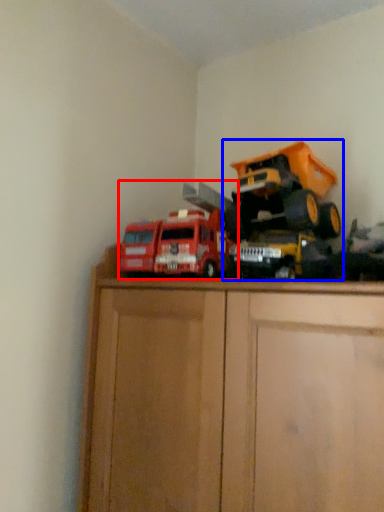
Question: Which of the following is the closest to the observer, toy (highlighted by a red box) or toy (highlighted by a blue box)?

Choices:
 (A) toy
 (B) toy

Answer: (B)